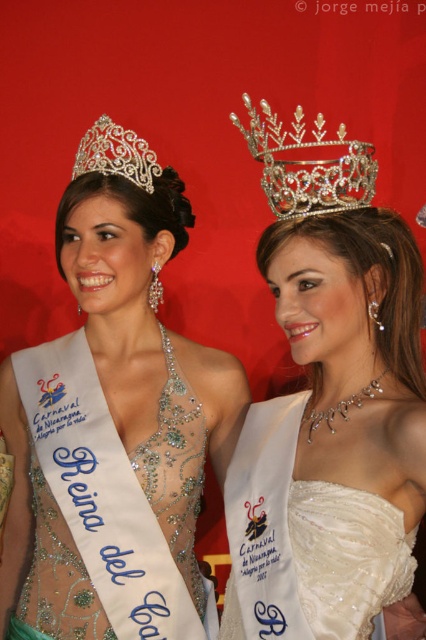
You are standing at a distance and want to know how far you are from the point marked at coordinates point (348, 604). Can you determine the distance?

The distance between you and the point marked at coordinates point (348, 604) is 3.41 feet.

You are a photographer setting up for a closeup shot of the two women in the image. You need to focus on both the matte silver tiara at upper center and the ivory satin dress at center. Given that the camera can only accommodate one object size in focus, which object should you adjust the focus for to ensure both are sharp?

The matte silver tiara at upper center has a larger width than the ivory satin dress at center, so you should adjust the focus for the matte silver tiara at upper center to ensure both objects are in sharp focus.